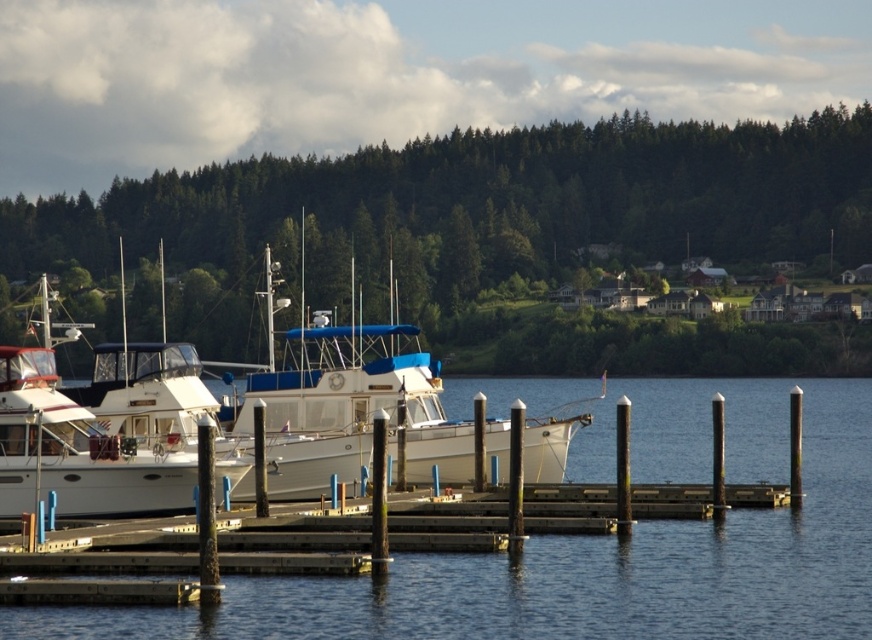
You are a photographer standing on the wooden dock at the marina. You want to capture a photo of the white glossy boat at center with the green leafy trees at upper center in the background. Given that your camera has a maximum focus range of 150 meters, will you be able to clearly capture both the boat and the trees in the same frame?

The green leafy trees at upper center are 141.53 meters away from the white glossy boat at center. Since the photographer is on the dock, the distance between the boat and the trees would determine if both can be in focus. However, the camera has a maximum focus range of 150 meters. Assuming the photographer is positioned such that both subjects are within the depth of field at this range, it should be possible to capture both clearly. The distance between them is within the camera limit.

You are standing on the wooden dock and want to check the water level under the white glossy boat at left. According to the scene, where would you look to see the clear blue water at center?

The clear blue water at center is positioned under the white glossy boat at left, so you should look directly beneath the white glossy boat at left to see the clear blue water at center.